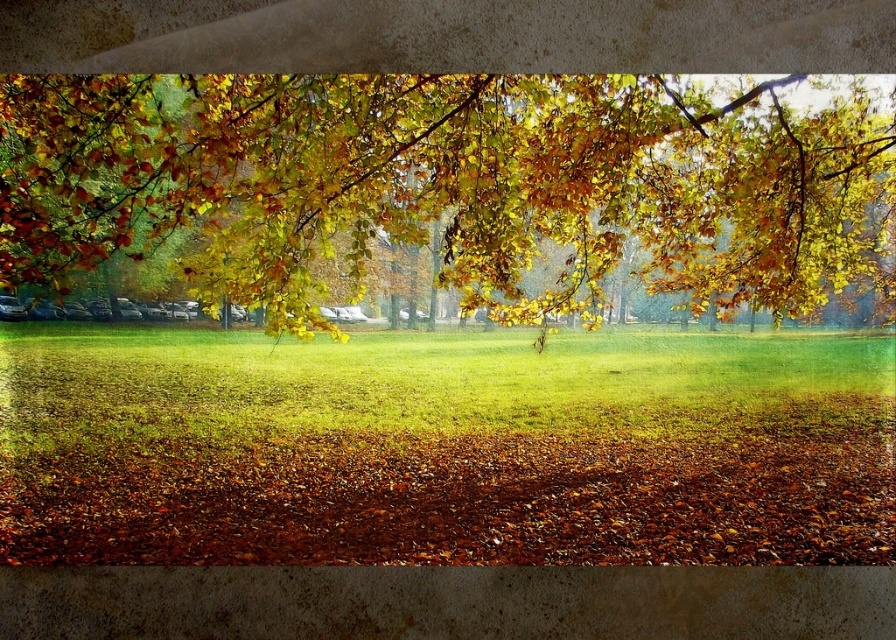
Question: Does yellow-green leaves at upper center come in front of green grassy field at center?

Choices:
 (A) yes
 (B) no

Answer: (A)

Question: Which object appears closest to the camera in this image?

Choices:
 (A) green grassy field at center
 (B) yellow-green leaves at upper center

Answer: (B)

Question: In this image, where is yellow-green leaves at upper center located relative to green grassy field at center?

Choices:
 (A) left
 (B) right

Answer: (B)

Question: Does yellow-green leaves at upper center appear on the left side of green grassy field at center?

Choices:
 (A) no
 (B) yes

Answer: (A)

Question: Which of the following is the closest to the observer?

Choices:
 (A) (658, 387)
 (B) (514, 131)

Answer: (B)